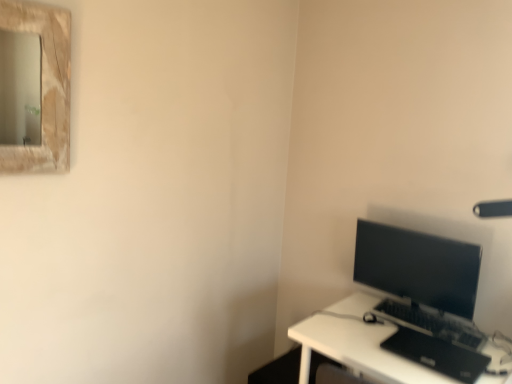
You are a GUI agent. You are given a task and a screenshot of the screen. Output one action in this format:
    pyautogui.click(x=<x>, y=<y>)
    Task: Click on the free space in front of matte black monitor at right
    The height and width of the screenshot is (384, 512).
    Given the screenshot: What is the action you would take?
    pyautogui.click(x=403, y=356)